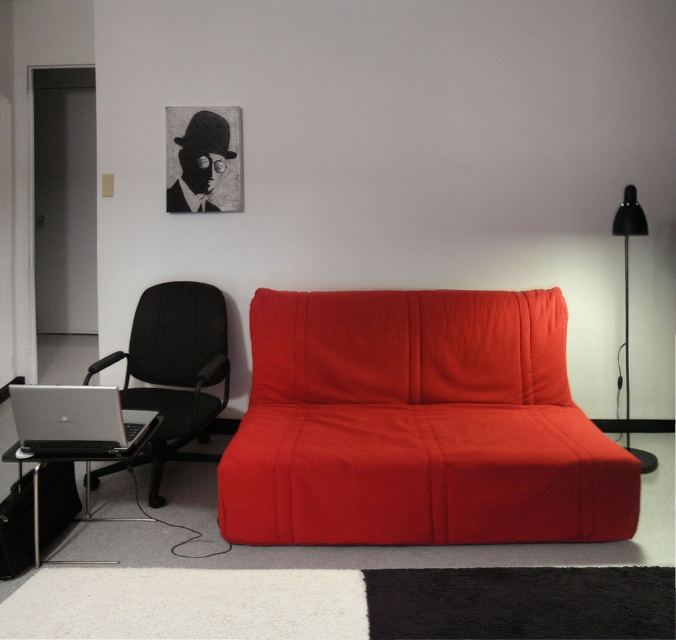
Question: Is black mesh swivel chair at left thinner than black matte floor lamp at right?

Choices:
 (A) no
 (B) yes

Answer: (A)

Question: Which of the following is the farthest from the observer?

Choices:
 (A) (621, 232)
 (B) (99, 422)
 (C) (206, 364)

Answer: (C)

Question: Does matte red couch at center have a larger size compared to black mesh swivel chair at left?

Choices:
 (A) no
 (B) yes

Answer: (B)

Question: Which of the following is the closest to the observer?

Choices:
 (A) black mesh swivel chair at left
 (B) black matte floor lamp at right
 (C) silver metallic laptop at left
 (D) matte red couch at center

Answer: (C)

Question: Which object appears closest to the camera in this image?

Choices:
 (A) black mesh swivel chair at left
 (B) silver metallic laptop at left
 (C) black matte floor lamp at right
 (D) matte red couch at center

Answer: (B)

Question: Does matte red couch at center have a greater width compared to black mesh swivel chair at left?

Choices:
 (A) no
 (B) yes

Answer: (B)